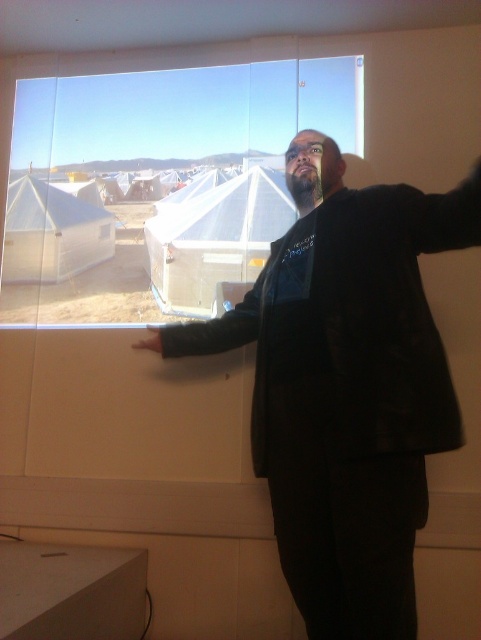
The image size is (481, 640). What do you see at coordinates (346, 385) in the screenshot?
I see `black leather jacket at upper right` at bounding box center [346, 385].

Can you confirm if black leather jacket at upper right is positioned to the right of black matte hand at lower left?

Indeed, black leather jacket at upper right is positioned on the right side of black matte hand at lower left.

Who is more distant from viewer, (369, 307) or (151, 339)?

Positioned behind is point (151, 339).

Where is `black leather jacket at upper right`? This screenshot has width=481, height=640. black leather jacket at upper right is located at coordinates (346, 385).

Could you measure the distance between black leather jacket at upper right and transparent glass window at upper center?

black leather jacket at upper right and transparent glass window at upper center are 28.75 inches apart from each other.

Can you confirm if black leather jacket at upper right is bigger than transparent glass window at upper center?

Yes, black leather jacket at upper right is bigger than transparent glass window at upper center.

The image size is (481, 640). I want to click on black leather jacket at upper right, so click(346, 385).

The width and height of the screenshot is (481, 640). I want to click on black leather jacket at upper right, so click(x=346, y=385).

Is transparent glass window at upper center shorter than black matte hand at lower left?

Incorrect, transparent glass window at upper center's height does not fall short of black matte hand at lower left's.

Which of these two, transparent glass window at upper center or black matte hand at lower left, stands shorter?

Standing shorter between the two is black matte hand at lower left.

Between point (169, 216) and point (142, 348), which one is positioned in front?

Positioned in front is point (142, 348).

Identify the location of transparent glass window at upper center. (157, 184).